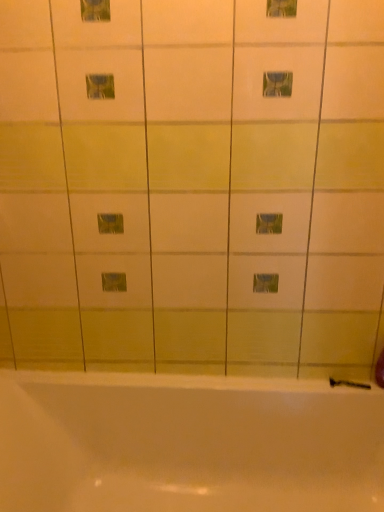
Question: In the image, is white glossy bathtub at lower center positioned in front of or behind black rubber shower at lower right?

Choices:
 (A) behind
 (B) front

Answer: (B)

Question: Considering the positions of point (342, 449) and point (369, 386), is point (342, 449) closer or farther from the camera than point (369, 386)?

Choices:
 (A) farther
 (B) closer

Answer: (B)

Question: Looking at the image, does white glossy bathtub at lower center seem bigger or smaller compared to black rubber shower at lower right?

Choices:
 (A) small
 (B) big

Answer: (B)

Question: Is black rubber shower at lower right bigger or smaller than white glossy bathtub at lower center?

Choices:
 (A) big
 (B) small

Answer: (B)

Question: Visually, is black rubber shower at lower right positioned to the left or to the right of white glossy bathtub at lower center?

Choices:
 (A) right
 (B) left

Answer: (A)

Question: Is black rubber shower at lower right in front of or behind white glossy bathtub at lower center in the image?

Choices:
 (A) behind
 (B) front

Answer: (A)

Question: Considering the positions of black rubber shower at lower right and white glossy bathtub at lower center in the image, is black rubber shower at lower right wider or thinner than white glossy bathtub at lower center?

Choices:
 (A) thin
 (B) wide

Answer: (A)